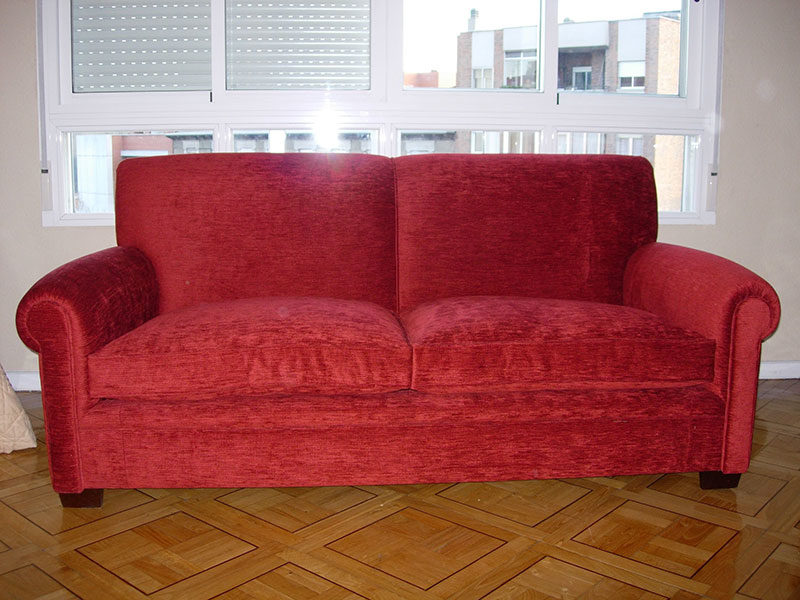
This screenshot has height=600, width=800. Identify the location of something on floor. (24, 436).